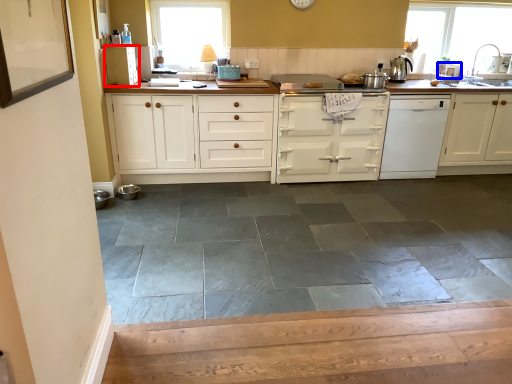
Question: Among these objects, which one is farthest to the camera, cabinetry (highlighted by a red box) or appliance (highlighted by a blue box)?

Choices:
 (A) cabinetry
 (B) appliance

Answer: (B)